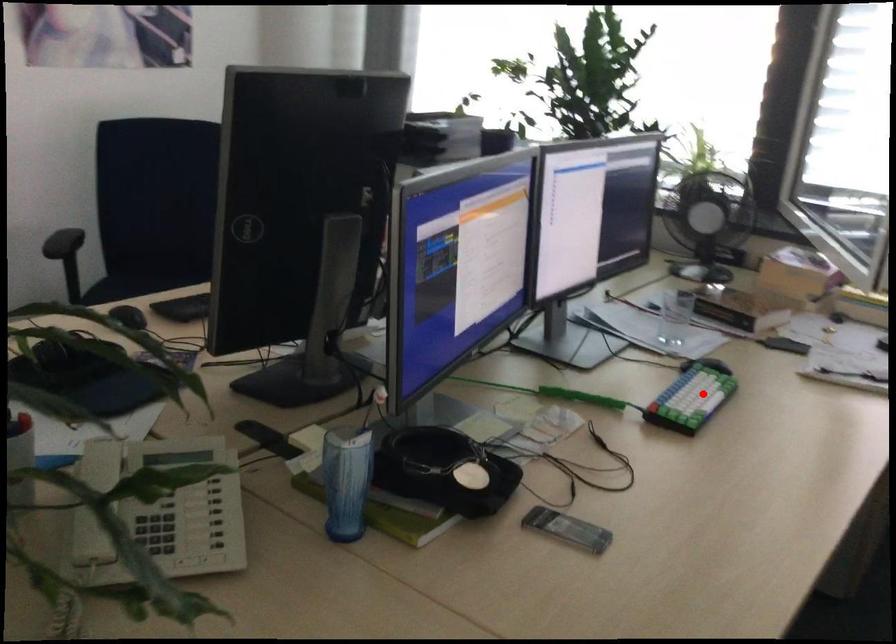
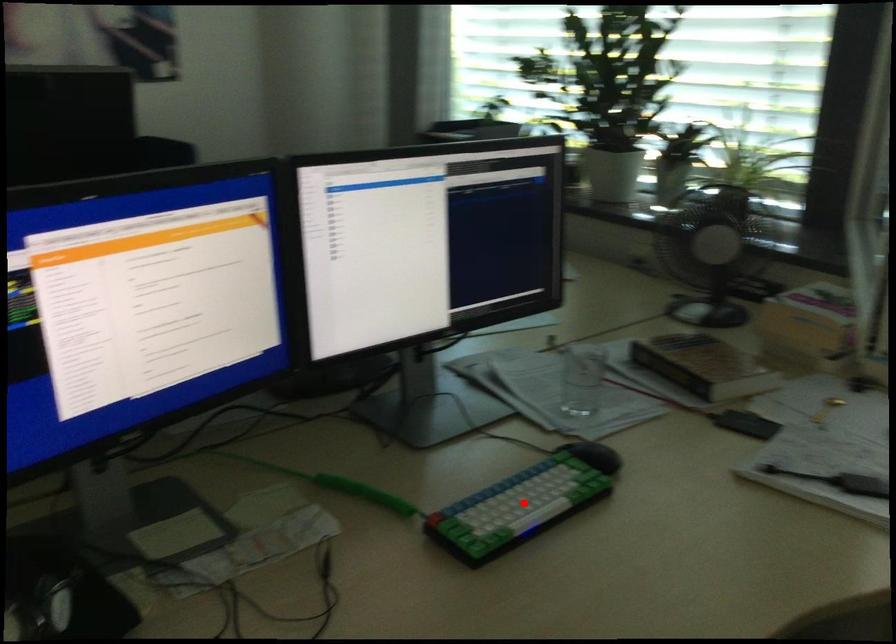
I am providing you with two images of the same scene from different viewpoints. A red point is marked on the first image and another point is marked on the second image. Is the marked point in image1 the same physical position as the marked point in image2?

Yes